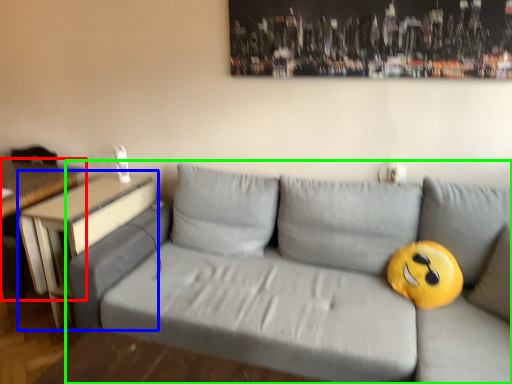
Question: Which object is the closest to the table (highlighted by a red box)? Choose among these: table (highlighted by a blue box) or studio couch (highlighted by a green box).

Choices:
 (A) table
 (B) studio couch

Answer: (A)